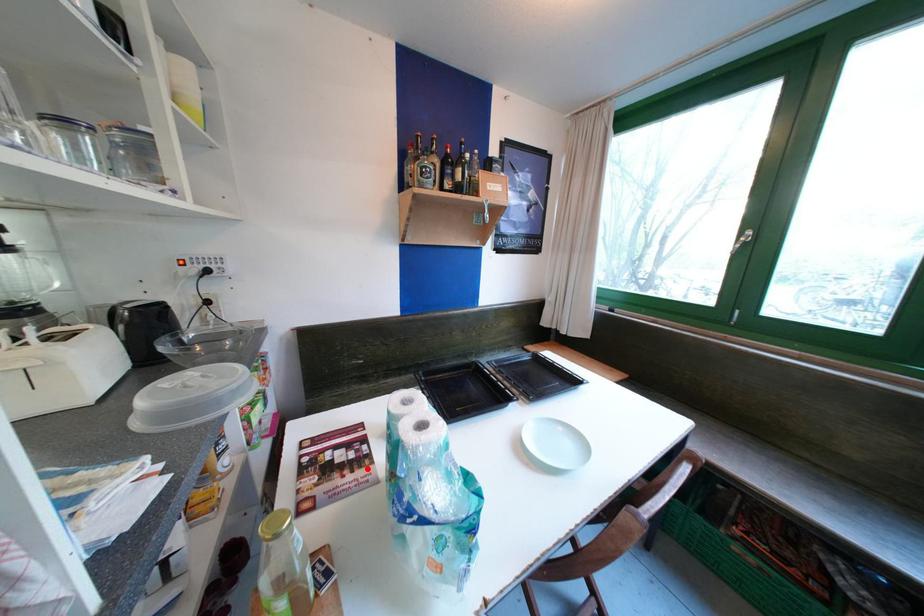
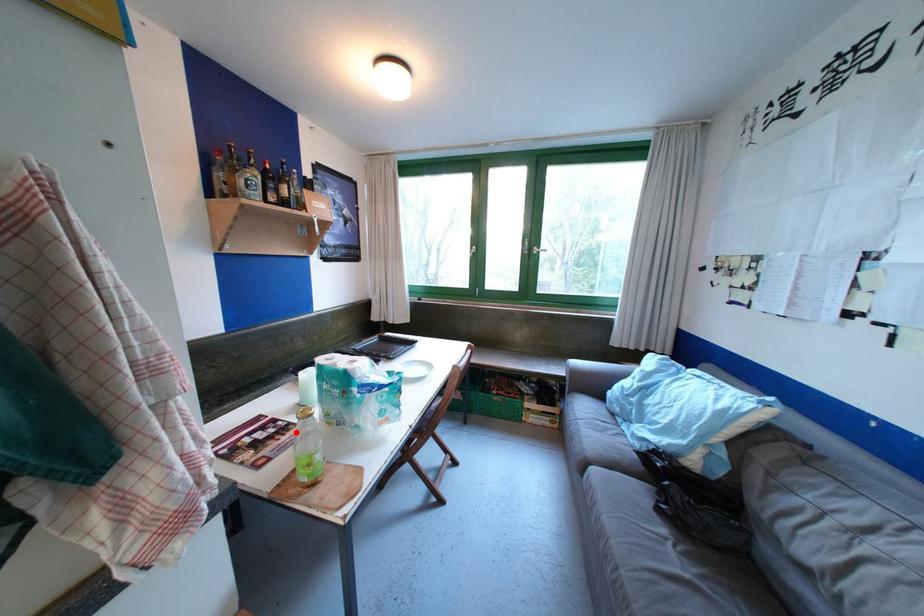
I am providing you with two images of the same scene from different viewpoints. A red point is marked on the first image and another point is marked on the second image. Does the point marked in image1 correspond to the same location as the one in image2?

Yes